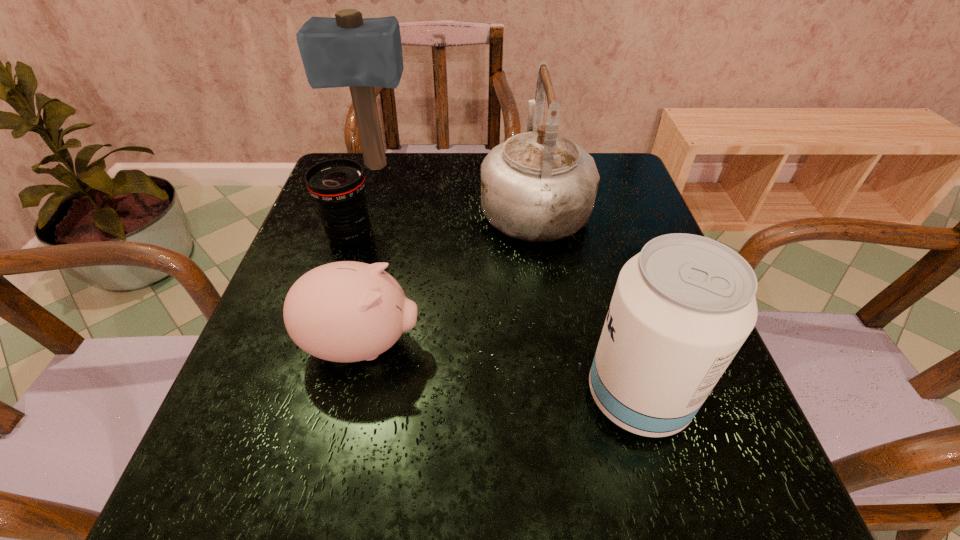
Locate an element on the screen. The height and width of the screenshot is (540, 960). blank space at the far edge is located at coordinates (401, 181).

In the image, there is a desktop. What are the coordinates of `free space at the near edge` in the screenshot? It's located at (460, 463).

Where is `blank space at the left edge of the desktop`? This screenshot has width=960, height=540. blank space at the left edge of the desktop is located at coordinates (271, 318).

The width and height of the screenshot is (960, 540). In the image, there is a desktop. Identify the location of free space at the right edge. (745, 429).

The height and width of the screenshot is (540, 960). Find the location of `free spot at the far right corner of the desktop`. free spot at the far right corner of the desktop is located at coordinates (608, 174).

Locate an element on the screen. This screenshot has height=540, width=960. vacant area at the near right corner is located at coordinates (736, 462).

The image size is (960, 540). I want to click on free spot between the piggy bank and the mallet, so click(x=369, y=255).

Locate an element on the screen. This screenshot has width=960, height=540. vacant space in between the alcohol and the tallest object is located at coordinates (506, 281).

Find the location of a particular element. This screenshot has width=960, height=540. empty location between the piggy bank and the kettle is located at coordinates (448, 275).

The width and height of the screenshot is (960, 540). I want to click on blank region between the alcohol and the piggy bank, so click(500, 370).